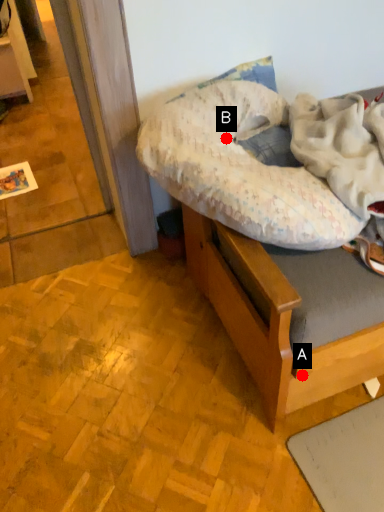
Question: Two points are circled on the image, labeled by A and B beside each circle. Which point appears closest to the camera in this image?

Choices:
 (A) A is closer
 (B) B is closer

Answer: (A)